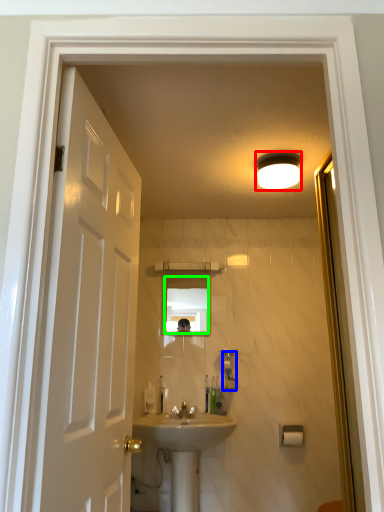
Question: Which is farther away from light fixture (highlighted by a red box)? soap dispenser (highlighted by a blue box) or mirror (highlighted by a green box)?

Choices:
 (A) soap dispenser
 (B) mirror

Answer: (B)